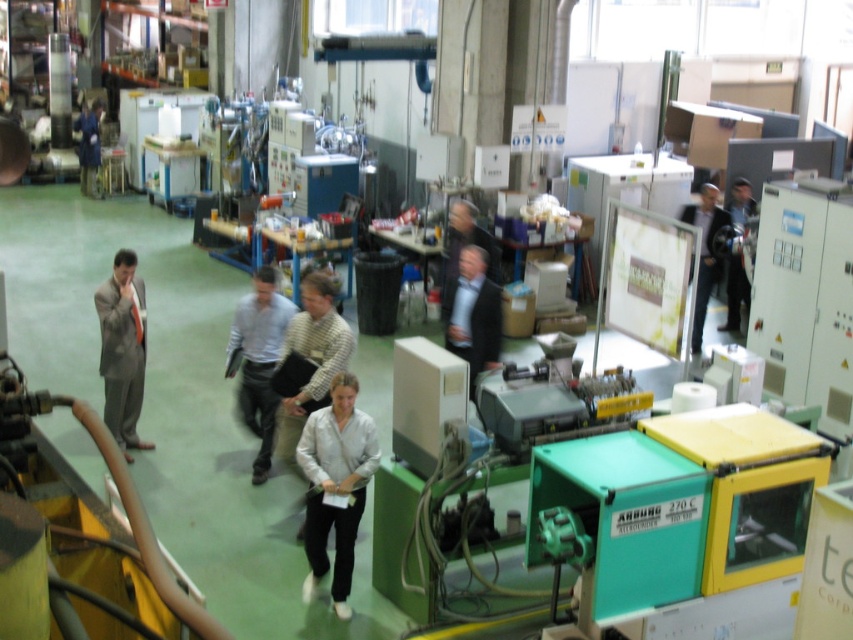
Question: Is white matte shirt at center further to the viewer compared to dark blue suit at center?

Choices:
 (A) no
 (B) yes

Answer: (A)

Question: Which point is farther from the camera taking this photo?

Choices:
 (A) [x=254, y=422]
 (B) [x=347, y=378]
 (C) [x=466, y=349]
 (D) [x=711, y=285]

Answer: (D)

Question: Considering the real-world distances, which object is farthest from the dark blue suit at center?

Choices:
 (A) dark gray suit at center
 (B) white matte shirt at center
 (C) light blue shirt at center

Answer: (A)

Question: Does matte gray suit at left have a smaller size compared to dark gray suit at center?

Choices:
 (A) no
 (B) yes

Answer: (B)

Question: Is white matte shirt at center further to the viewer compared to dark gray suit at center?

Choices:
 (A) yes
 (B) no

Answer: (B)

Question: Among these points, which one is farthest from the camera?

Choices:
 (A) (138, 390)
 (B) (338, 378)
 (C) (701, 232)
 (D) (497, 364)

Answer: (C)